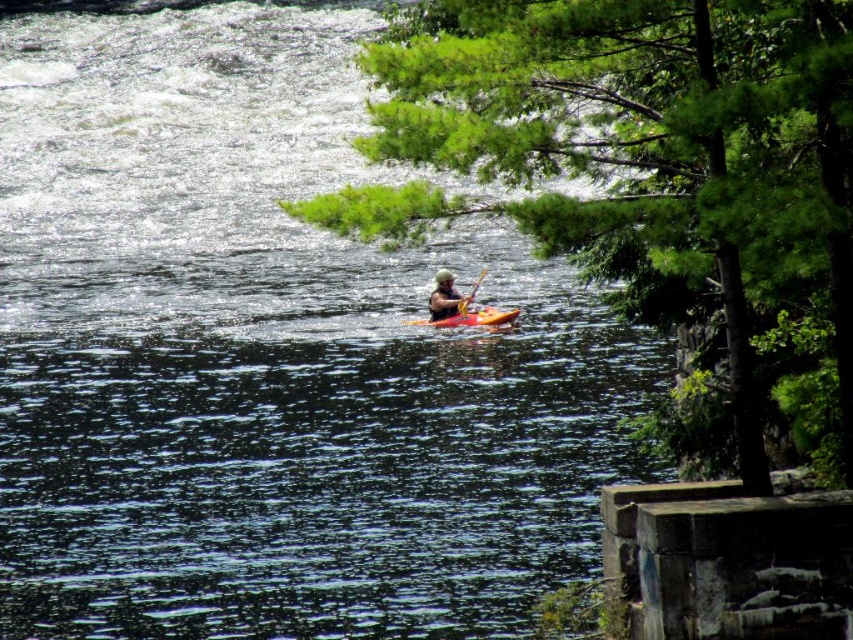
Question: Which of the following is the farthest from the observer?

Choices:
 (A) (x=445, y=323)
 (B) (x=839, y=3)
 (C) (x=471, y=291)

Answer: (C)

Question: Is orange matte kayak at center to the right of yellow wood paddle at center from the viewer's perspective?

Choices:
 (A) yes
 (B) no

Answer: (B)

Question: Can you confirm if green leafy tree at upper right is positioned to the right of orange matte kayak at center?

Choices:
 (A) no
 (B) yes

Answer: (B)

Question: Considering the real-world distances, which object is closest to the yellow wood paddle at center?

Choices:
 (A) orange matte kayak at center
 (B) green leafy tree at upper right

Answer: (A)

Question: Is orange matte kayak at center wider than yellow wood paddle at center?

Choices:
 (A) no
 (B) yes

Answer: (B)

Question: Which object is positioned farthest from the yellow wood paddle at center?

Choices:
 (A) matte green helmet at center
 (B) orange matte kayak at center

Answer: (B)